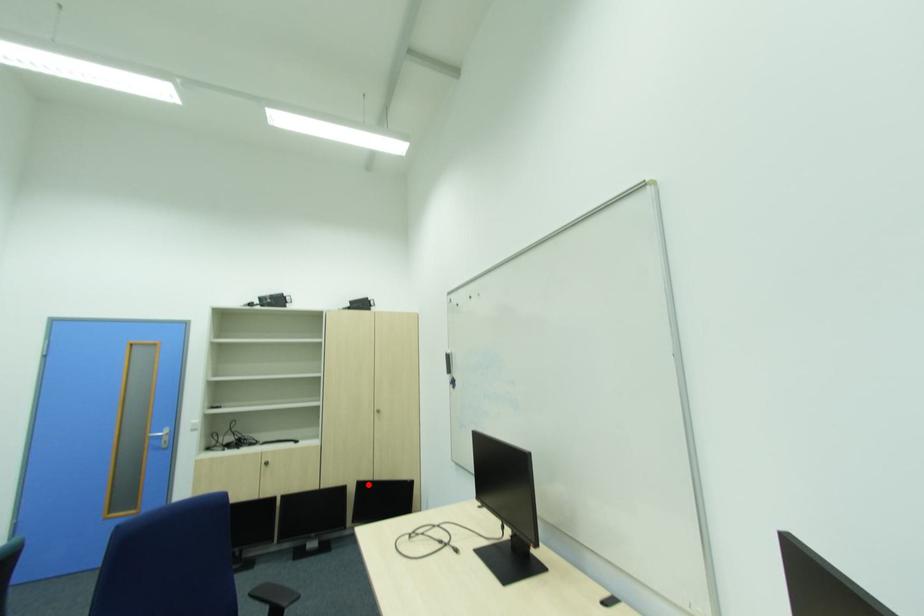
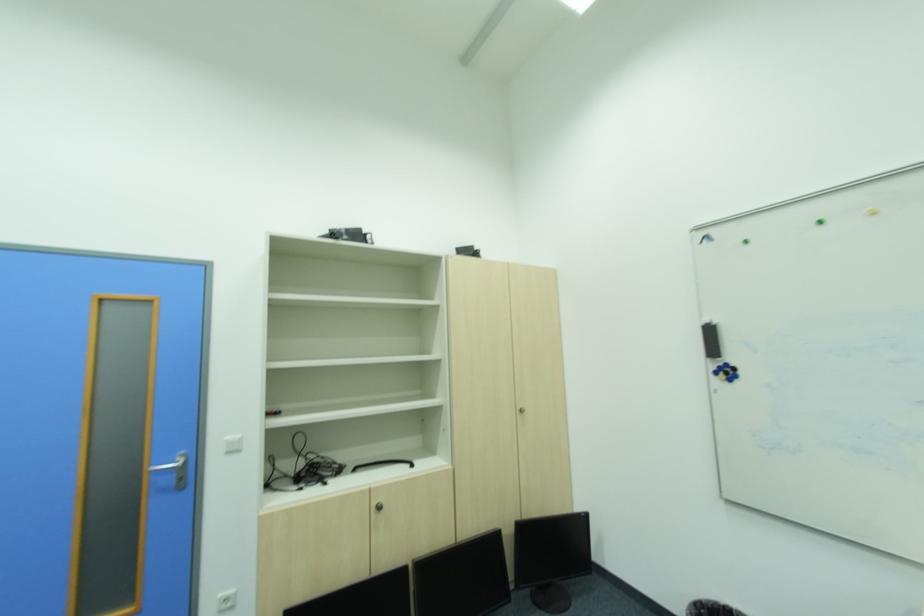
Locate, in the second image, the point that corresponds to the highlighted location in the first image.

(531, 531)